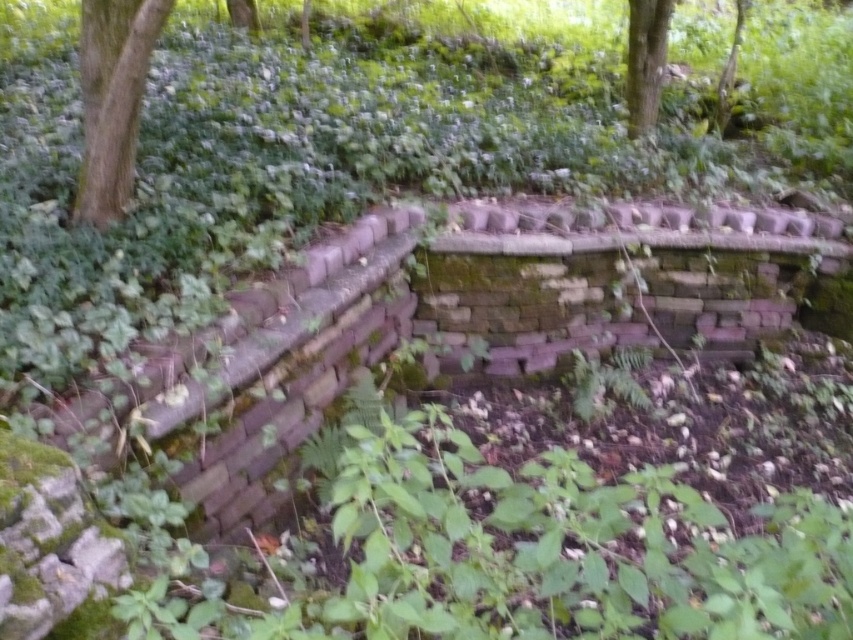
You are standing at the camera position and want to reach the point marked as point (84, 186). Is this point within a 5 feet radius from your current position?

The distance between the camera and point (84, 186) is 6.48 feet, which is beyond the 5 feet radius, so you cannot reach it within that distance.

In the scene shown: You are a bird looking for a nesting spot. You see the green rough bark tree at upper left and the green mossy tree at upper center. Which tree is positioned lower in the image?

The green rough bark tree at upper left is positioned lower than the green mossy tree at upper center.